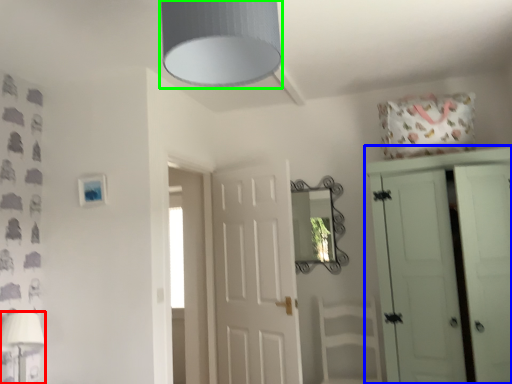
Question: Considering the real-world distances, which object is closest to table lamp (highlighted by a red box)? cupboard (highlighted by a blue box) or light fixture (highlighted by a green box).

Choices:
 (A) cupboard
 (B) light fixture

Answer: (B)